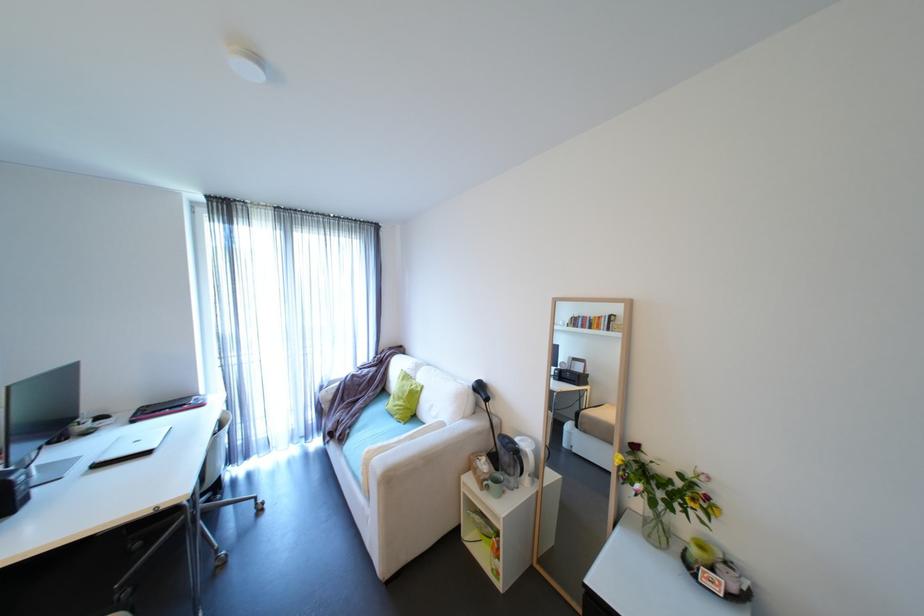
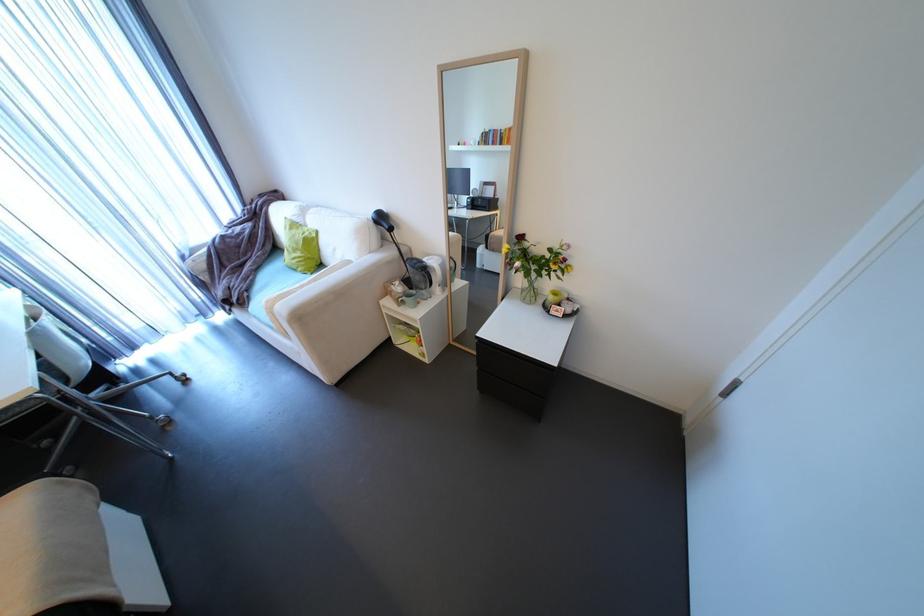
Locate, in the second image, the point that corresponds to point (492, 471) in the first image.

(407, 292)